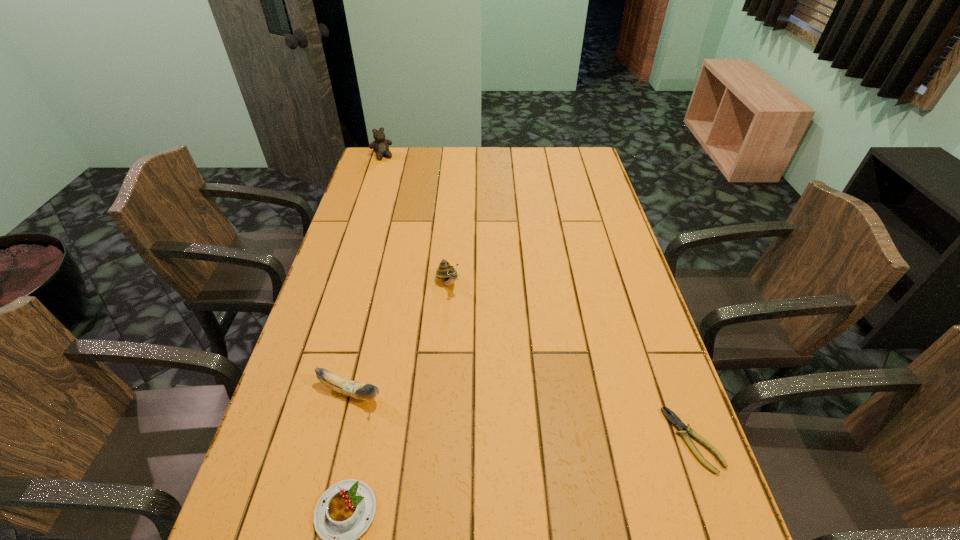
Identify the location of the rightmost object. (676, 421).

Identify the location of pliers. This screenshot has width=960, height=540. (676, 421).

Locate an element on the screen. This screenshot has height=540, width=960. teddy bear is located at coordinates (380, 145).

Locate an element on the screen. The width and height of the screenshot is (960, 540). the second object from right to left is located at coordinates (446, 272).

Find the location of a particular element. This screenshot has height=540, width=960. the second farthest object is located at coordinates (446, 272).

At what (x,y) coordinates should I click in order to perform the action: click on banana. Please return your answer as a coordinate pair (x, y). This screenshot has height=540, width=960. Looking at the image, I should click on (353, 389).

Image resolution: width=960 pixels, height=540 pixels. Find the location of `vacant space positioned 0.060m on the front of the shortest object`. vacant space positioned 0.060m on the front of the shortest object is located at coordinates (717, 507).

Where is `vacant space situated on the face of the teddy bear`? This screenshot has width=960, height=540. vacant space situated on the face of the teddy bear is located at coordinates (393, 173).

You are a GUI agent. You are given a task and a screenshot of the screen. Output one action in this format:
    pyautogui.click(x=<x>, y=<y>)
    Task: Click on the vacant space situated on the face of the teddy bear
    The image size is (960, 540).
    Given the screenshot: What is the action you would take?
    pyautogui.click(x=414, y=210)

Where is `free space located 0.070m on the face of the teddy bear`? This screenshot has width=960, height=540. free space located 0.070m on the face of the teddy bear is located at coordinates (390, 169).